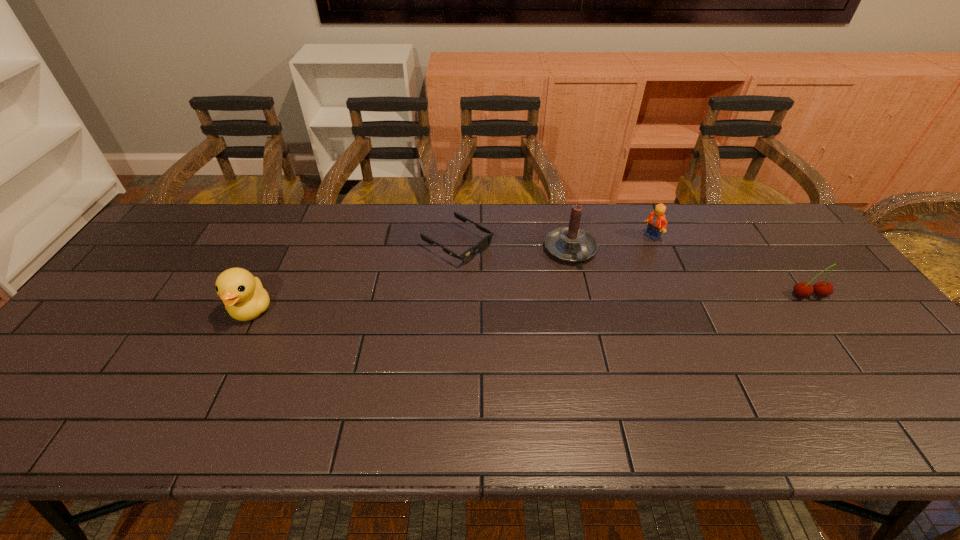
The image size is (960, 540). Identify the location of vacant space in between the leftmost object and the candle. (411, 280).

Where is `free space between the leftmost object and the rightmost object`? This screenshot has width=960, height=540. free space between the leftmost object and the rightmost object is located at coordinates (531, 303).

This screenshot has height=540, width=960. In order to click on empty location between the cherry and the fourth object from left to right in this screenshot , I will do `click(731, 266)`.

Where is `vacant point located between the cherry and the Lego`? vacant point located between the cherry and the Lego is located at coordinates (731, 266).

The width and height of the screenshot is (960, 540). I want to click on empty space between the candle and the fourth object from left to right, so click(x=612, y=244).

Image resolution: width=960 pixels, height=540 pixels. I want to click on vacant space that's between the leftmost object and the third object from left to right, so click(411, 280).

Locate an element on the screen. vacant area between the rightmost object and the candle is located at coordinates (689, 273).

Where is `object that ranks as the third closest to the cherry`? The height and width of the screenshot is (540, 960). object that ranks as the third closest to the cherry is located at coordinates (467, 256).

Select which object appears as the third closest to the leftmost object. Please provide its 2D coordinates. Your answer should be formatted as a tuple, i.e. [(x, y)], where the tuple contains the x and y coordinates of a point satisfying the conditions above.

[(657, 223)]

Image resolution: width=960 pixels, height=540 pixels. Identify the location of vacant area in the image that satisfies the following two spatial constraints: 1. on the back side of the Lego; 2. on the left side of the sunglasses. (458, 237).